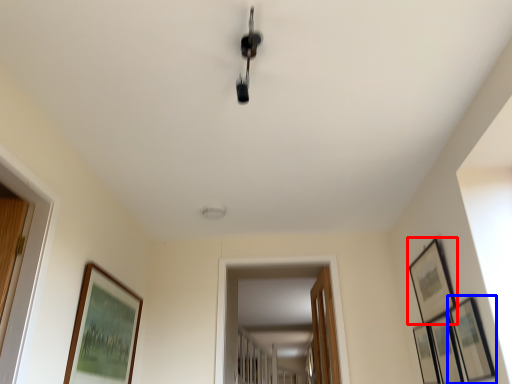
Question: Which of the following is the closest to the observer, picture frame (highlighted by a red box) or picture frame (highlighted by a blue box)?

Choices:
 (A) picture frame
 (B) picture frame

Answer: (B)